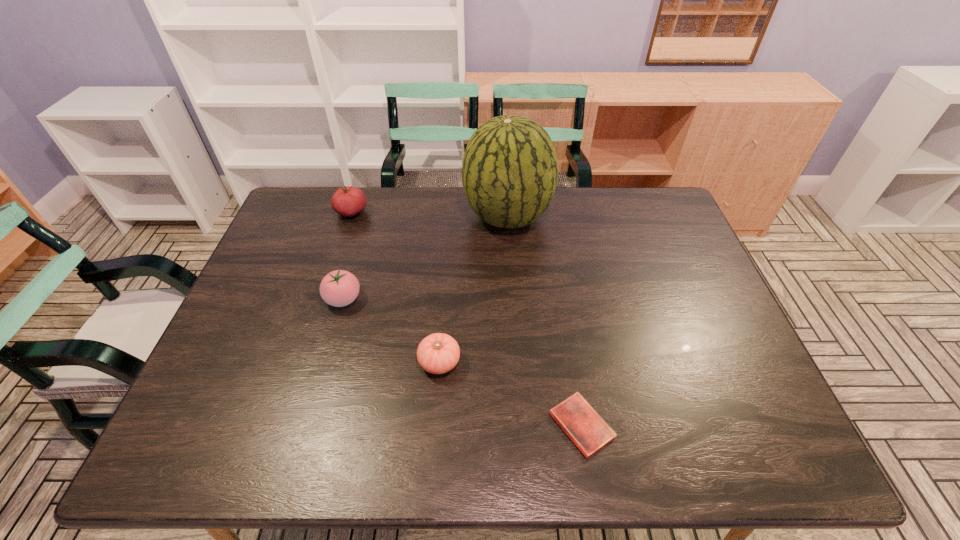
This screenshot has height=540, width=960. I want to click on vacant point at the far right corner, so click(638, 197).

What are the coordinates of `vacant space that's between the diary and the fourth farthest object` in the screenshot? It's located at (511, 394).

At what (x,y) coordinates should I click in order to perform the action: click on vacant area that lies between the tallest object and the shortest object. Please return your answer as a coordinate pair (x, y). The width and height of the screenshot is (960, 540). Looking at the image, I should click on (544, 321).

The width and height of the screenshot is (960, 540). I want to click on unoccupied area between the third farthest object and the watermelon, so click(425, 258).

Locate an element on the screen. vacant space that is in between the shortest object and the farthest tomato is located at coordinates (467, 319).

Find the location of `vacant space that is in between the farthest tomato and the fourth tallest object`. vacant space that is in between the farthest tomato and the fourth tallest object is located at coordinates (396, 287).

Where is `empty space that is in between the fourth tallest object and the shortest object`? This screenshot has height=540, width=960. empty space that is in between the fourth tallest object and the shortest object is located at coordinates (511, 394).

Image resolution: width=960 pixels, height=540 pixels. What are the coordinates of `free space between the tallest object and the nearest tomato` in the screenshot? It's located at click(x=473, y=289).

Locate an element on the screen. This screenshot has height=540, width=960. free space between the farthest tomato and the shortest tomato is located at coordinates (396, 287).

Where is `vacant space that is in between the shortest object and the tallest object`? The height and width of the screenshot is (540, 960). vacant space that is in between the shortest object and the tallest object is located at coordinates (544, 321).